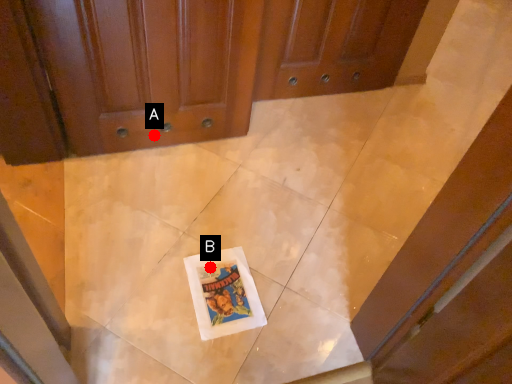
Question: Two points are circled on the image, labeled by A and B beside each circle. Which point is closer to the camera?

Choices:
 (A) A is closer
 (B) B is closer

Answer: (B)